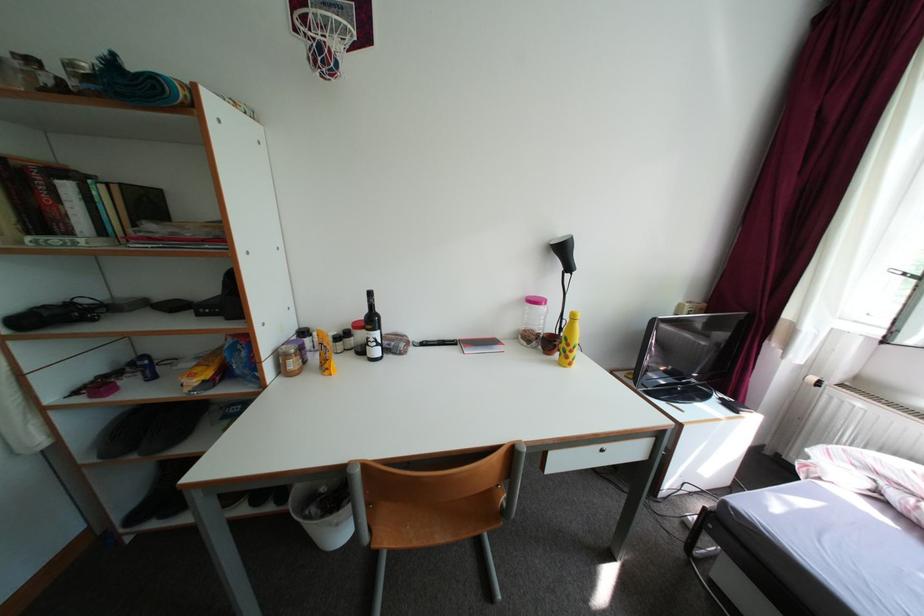
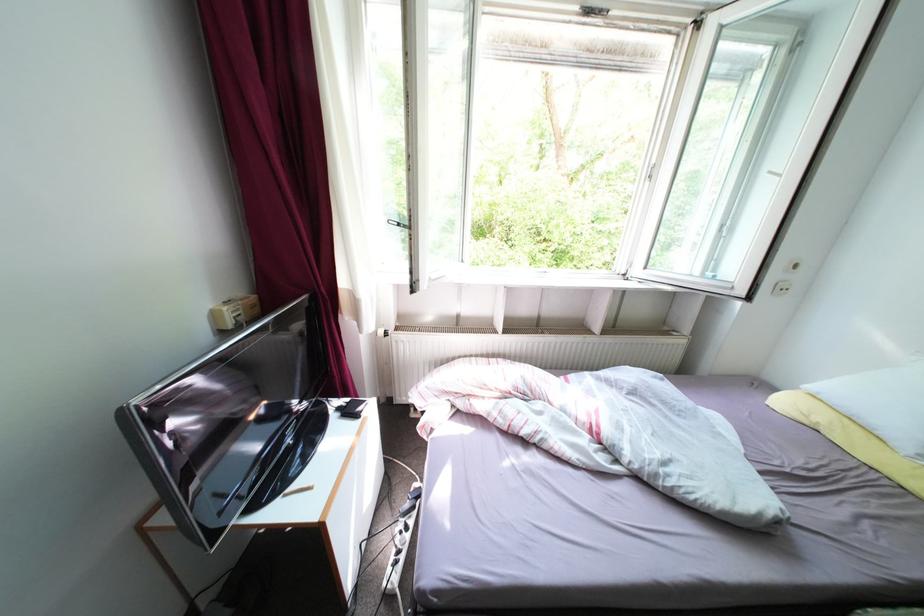
How did the camera likely rotate?

The camera's rotation is toward right-down.